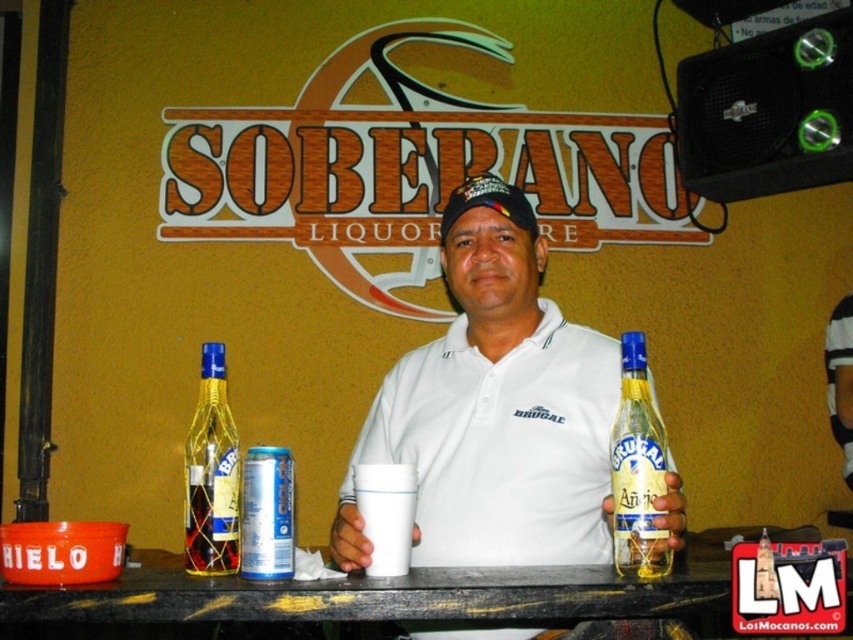
You are a customer at SOBERANO LIQUOR and you want to grab the translucent glass bottle at center and the translucent glass bottle at left. Which one is closer to you?

The translucent glass bottle at left is closer to you because the translucent glass bottle at center is above it.